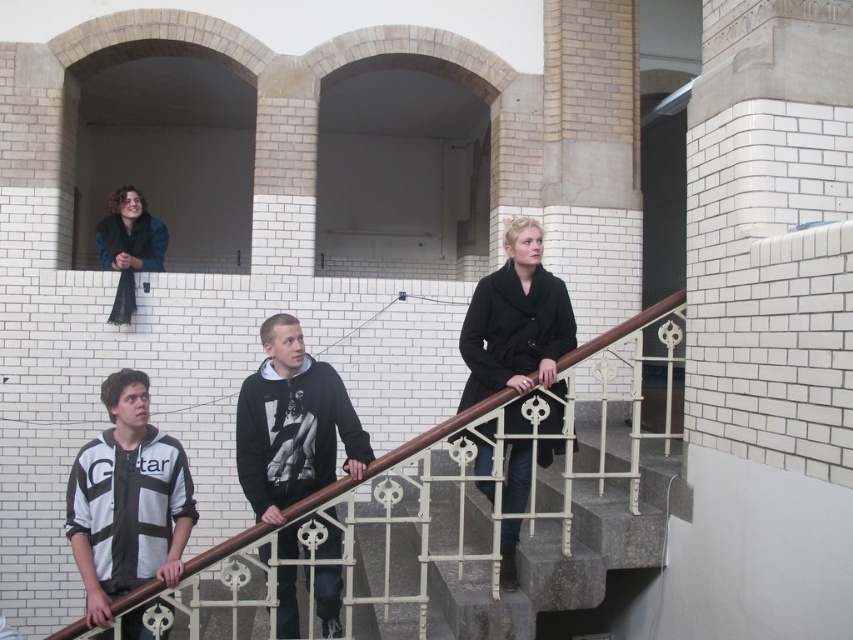
Question: Which point is closer to the camera taking this photo?

Choices:
 (A) pyautogui.click(x=268, y=496)
 (B) pyautogui.click(x=419, y=444)
 (C) pyautogui.click(x=514, y=572)
 (D) pyautogui.click(x=149, y=220)

Answer: (B)

Question: Which of the following is the closest to the observer?

Choices:
 (A) (132, 500)
 (B) (77, 634)
 (C) (555, 387)
 (D) (322, 636)

Answer: (B)

Question: Is brown polished wood at lower center further to camera compared to dark blue jacket at upper left?

Choices:
 (A) no
 (B) yes

Answer: (A)

Question: Among these points, which one is farthest from the camera?

Choices:
 (A) (120, 204)
 (B) (84, 461)
 (C) (404, 449)
 (D) (543, 460)

Answer: (A)

Question: Does black hoodie at center have a greater width compared to dark blue jacket at upper left?

Choices:
 (A) no
 (B) yes

Answer: (B)

Question: Does black hoodie at center have a smaller size compared to black matte coat at center?

Choices:
 (A) no
 (B) yes

Answer: (A)